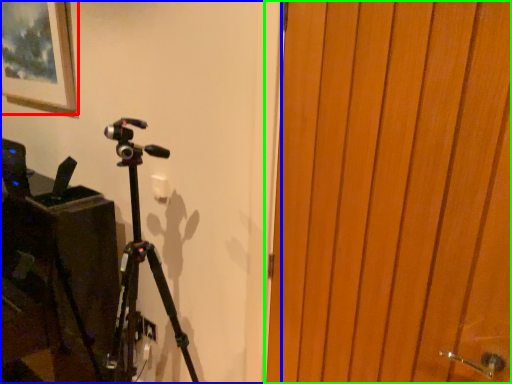
Question: Estimate the real-world distances between objects in this image. Which object is farther from picture frame (highlighted by a red box), backdrop (highlighted by a blue box) or door (highlighted by a green box)?

Choices:
 (A) backdrop
 (B) door

Answer: (B)